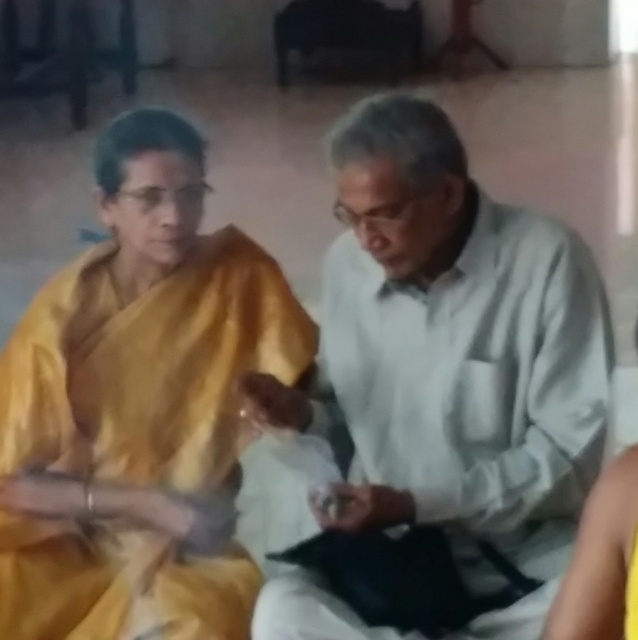
Does white matte shirt at center appear on the left side of yellow silk saree at left?

Incorrect, white matte shirt at center is not on the left side of yellow silk saree at left.

Who is positioned more to the left, white matte shirt at center or yellow silk saree at left?

From the viewer's perspective, yellow silk saree at left appears more on the left side.

Between point (498, 614) and point (248, 332), which one is positioned in front?

Positioned in front is point (498, 614).

The height and width of the screenshot is (640, 638). What are the coordinates of `white matte shirt at center` in the screenshot? It's located at (445, 397).